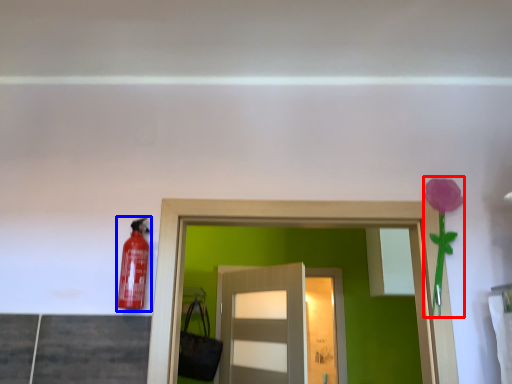
Question: Which object appears closest to the camera in this image, flower (highlighted by a red box) or extinguisher (highlighted by a blue box)?

Choices:
 (A) flower
 (B) extinguisher

Answer: (B)